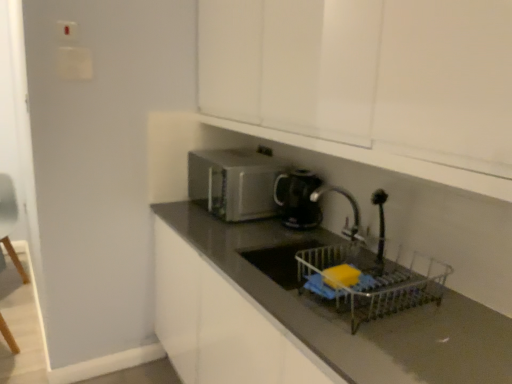
You are a GUI agent. You are given a task and a screenshot of the screen. Output one action in this format:
    pyautogui.click(x=<x>, y=<y>)
    Task: Click on the free space in front of metallic silver dish rack at lower center
    The height and width of the screenshot is (384, 512).
    Given the screenshot: What is the action you would take?
    pyautogui.click(x=396, y=352)